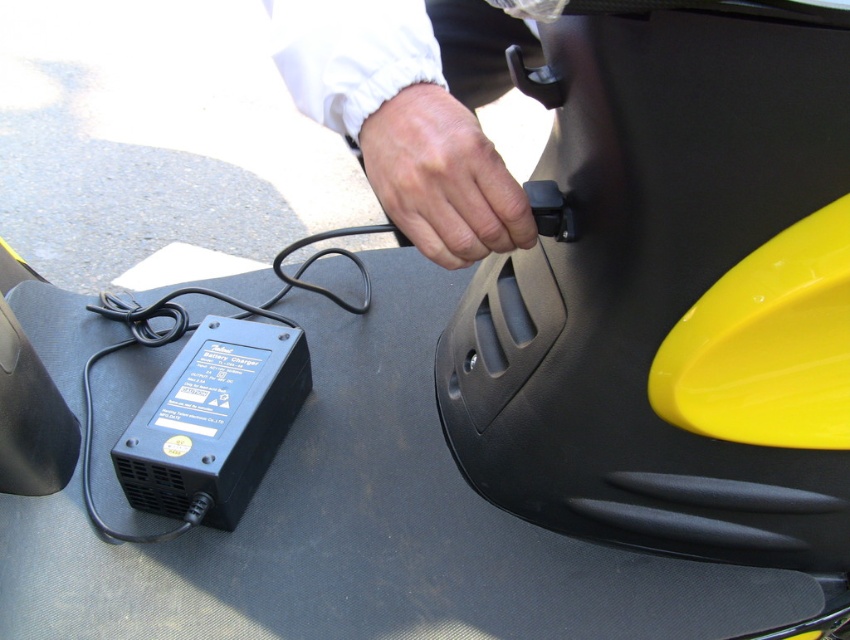
Question: Which object is closer to the camera taking this photo?

Choices:
 (A) black plastic plug at lower left
 (B) skinny white hand at center
 (C) white fabric hand at upper center

Answer: (C)

Question: Considering the relative positions of white fabric hand at upper center and black plastic plug at lower left in the image provided, where is white fabric hand at upper center located with respect to black plastic plug at lower left?

Choices:
 (A) above
 (B) below

Answer: (A)

Question: Which of the following is the farthest from the observer?

Choices:
 (A) black plastic plug at lower left
 (B) white fabric hand at upper center

Answer: (A)

Question: Does white fabric hand at upper center have a smaller size compared to skinny white hand at center?

Choices:
 (A) no
 (B) yes

Answer: (A)

Question: Among these objects, which one is nearest to the camera?

Choices:
 (A) skinny white hand at center
 (B) black plastic plug at lower left
 (C) white fabric hand at upper center

Answer: (C)

Question: Can you confirm if white fabric hand at upper center is positioned to the right of black plastic plug at lower left?

Choices:
 (A) no
 (B) yes

Answer: (B)